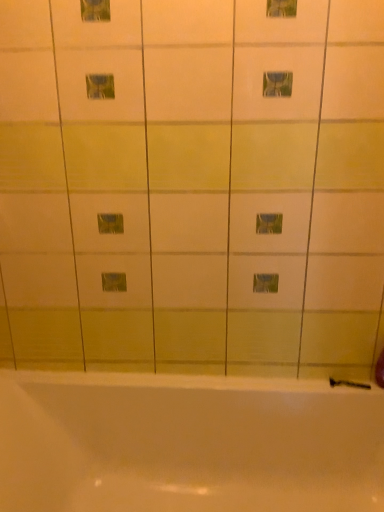
Question: Can you confirm if black rubber shower at lower right is bigger than white glossy bathtub at lower center?

Choices:
 (A) yes
 (B) no

Answer: (B)

Question: Is black rubber shower at lower right next to white glossy bathtub at lower center and touching it?

Choices:
 (A) yes
 (B) no

Answer: (B)

Question: Can you confirm if black rubber shower at lower right is positioned to the right of white glossy bathtub at lower center?

Choices:
 (A) no
 (B) yes

Answer: (B)

Question: Is white glossy bathtub at lower center at the back of black rubber shower at lower right?

Choices:
 (A) no
 (B) yes

Answer: (B)

Question: Is black rubber shower at lower right outside of white glossy bathtub at lower center?

Choices:
 (A) no
 (B) yes

Answer: (A)

Question: Considering the relative positions of black rubber shower at lower right and white glossy bathtub at lower center in the image provided, is black rubber shower at lower right behind white glossy bathtub at lower center?

Choices:
 (A) yes
 (B) no

Answer: (A)

Question: Can you confirm if white glossy bathtub at lower center is taller than black rubber shower at lower right?

Choices:
 (A) yes
 (B) no

Answer: (A)

Question: Would you consider white glossy bathtub at lower center to be distant from black rubber shower at lower right?

Choices:
 (A) no
 (B) yes

Answer: (A)

Question: Could you tell me if white glossy bathtub at lower center is turned towards black rubber shower at lower right?

Choices:
 (A) yes
 (B) no

Answer: (B)

Question: From the image's perspective, is white glossy bathtub at lower center beneath black rubber shower at lower right?

Choices:
 (A) no
 (B) yes

Answer: (B)

Question: From a real-world perspective, is white glossy bathtub at lower center positioned under black rubber shower at lower right based on gravity?

Choices:
 (A) yes
 (B) no

Answer: (A)

Question: Is white glossy bathtub at lower center at the right side of black rubber shower at lower right?

Choices:
 (A) yes
 (B) no

Answer: (B)

Question: From a real-world perspective, is white glossy bathtub at lower center physically located above or below black rubber shower at lower right?

Choices:
 (A) above
 (B) below

Answer: (B)